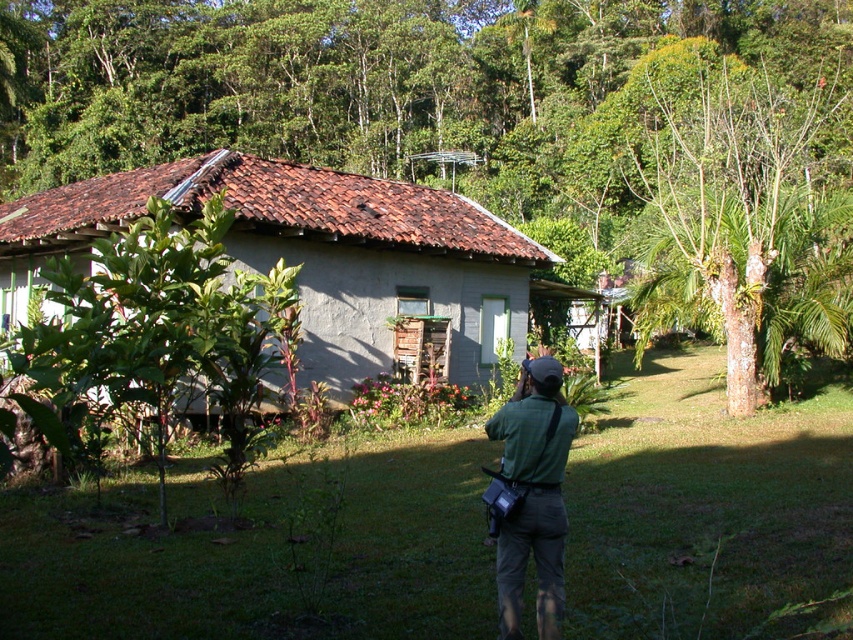
Can you confirm if gray stucco hut at center is taller than green leafy plant at center?

Yes.

Is point (474, 224) closer to camera compared to point (155, 262)?

That is False.

The image size is (853, 640). What are the coordinates of `gray stucco hut at center` in the screenshot? It's located at (312, 253).

Which of these two, brown wood tree at center or green leafy plant at center, stands shorter?

green leafy plant at center is shorter.

Is point (737, 147) closer to viewer compared to point (207, 204)?

No.

I want to click on brown wood tree at center, so click(451, 104).

Which of these two, smooth brown trunk at upper right or green fabric camera bag at center, stands taller?

With more height is smooth brown trunk at upper right.

Who is shorter, smooth brown trunk at upper right or green fabric camera bag at center?

Standing shorter between the two is green fabric camera bag at center.

Does point (676, 60) lie behind point (540, 374)?

Yes.

Where is `smooth brown trunk at upper right`? Image resolution: width=853 pixels, height=640 pixels. smooth brown trunk at upper right is located at coordinates (718, 173).